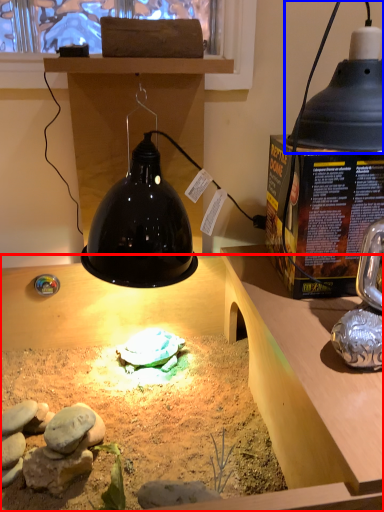
Question: Which object appears farthest to the camera in this image, desk (highlighted by a red box) or lamp (highlighted by a blue box)?

Choices:
 (A) desk
 (B) lamp

Answer: (B)